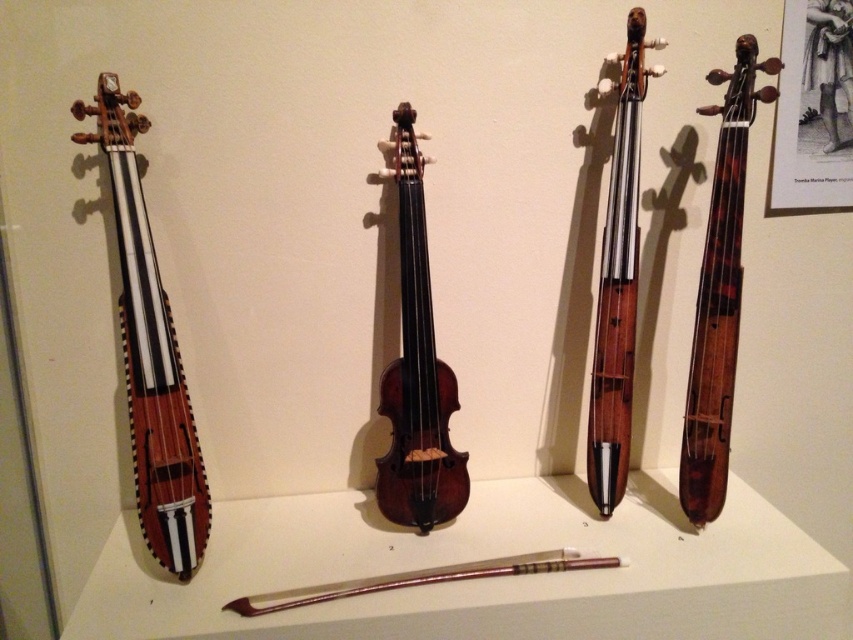
You are a music teacher preparing for a class. You need to choose a violin for a young student who requires a smaller instrument. Based on the image, which violin between the wooden violin at left and the wooden violin at center would be more suitable?

The wooden violin at left is smaller in size compared to the wooden violin at center, making it more suitable for a young student needing a smaller instrument.

You are a music teacher preparing a lesson. You have two violins available for demonstration. The wooden violin at left and the wooden violin at center. Which one has a wider body?

The wooden violin at left has a wider body than the wooden violin at center.

You are a musician who wants to choose a violin that is easier to handle. Which one between the shiny brown violin at center and the wooden violin at center would you choose based on their sizes?

The shiny brown violin at center is shorter than the wooden violin at center, so it would be easier to handle for someone preferring a smaller size.